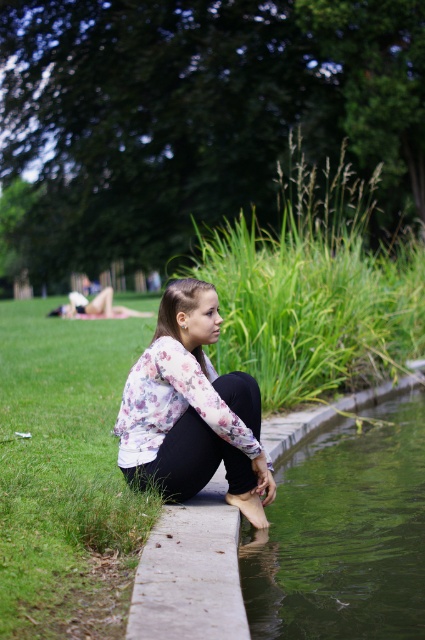
You are standing at the center of the park and want to reach the green smooth water at lower center. According to the coordinates provided, in which direction should you move to get there?

The green smooth water at lower center is located at coordinates point [343,534], so you should move towards the lower right direction to reach it.

You are a photographer trying to capture a closeup of the floral fabric shirt at center while also including the green smooth water at lower center in the frame. Based on their distance, can you fit both into the same photo without moving the camera?

The green smooth water at lower center and floral fabric shirt at center are 29.86 inches apart. Since the distance between them is relatively small, you can likely fit both into the same photo without moving the camera.

You are a photographer planning to take a portrait of the young woman in the scene. You want to position your camera at a specific coordinate to ensure the floral fabric shirt at center is centered in the frame. What coordinates should you aim for?

The floral fabric shirt at center is located at coordinates point (192,410), so you should aim your camera at those coordinates to center it in the frame.